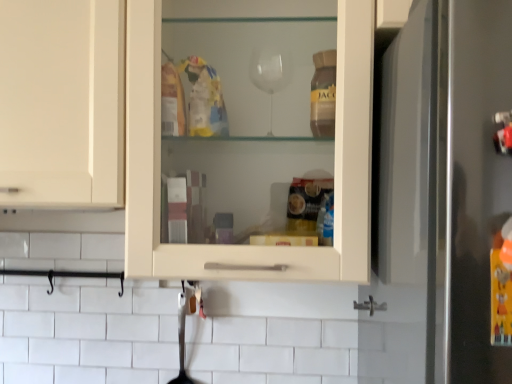
In order to click on matte white cupboard at center in this screenshot , I will do `click(247, 246)`.

What do you see at coordinates (247, 246) in the screenshot? The image size is (512, 384). I see `matte white cupboard at center` at bounding box center [247, 246].

Find the location of `matte white cupboard at center`. matte white cupboard at center is located at coordinates (247, 246).